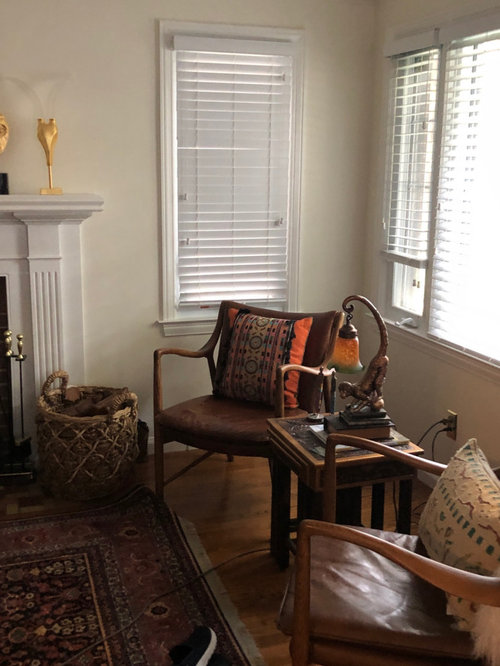
You are a GUI agent. You are given a task and a screenshot of the screen. Output one action in this format:
    pyautogui.click(x=<x>, y=<y>)
    Task: Click on the book
    Image resolution: width=500 pixels, height=666 pixels.
    Given the screenshot: What is the action you would take?
    pyautogui.click(x=334, y=427)